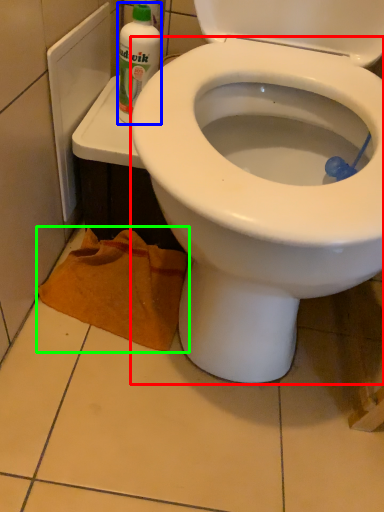
Question: Based on their relative distances, which object is farther from bidet (highlighted by a red box)? Choose from cleaning product (highlighted by a blue box) and material (highlighted by a green box).

Choices:
 (A) cleaning product
 (B) material

Answer: (A)